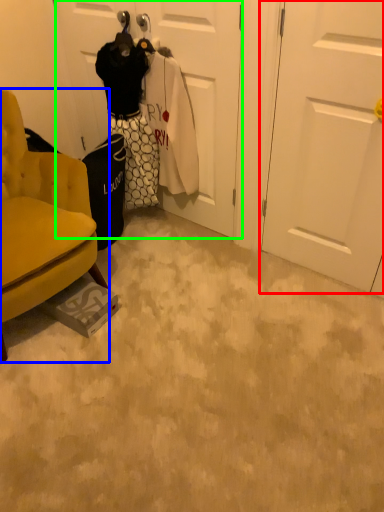
Question: Which object is positioned farthest from door (highlighted by a red box)? Select from chair (highlighted by a blue box) and door (highlighted by a green box).

Choices:
 (A) chair
 (B) door

Answer: (A)